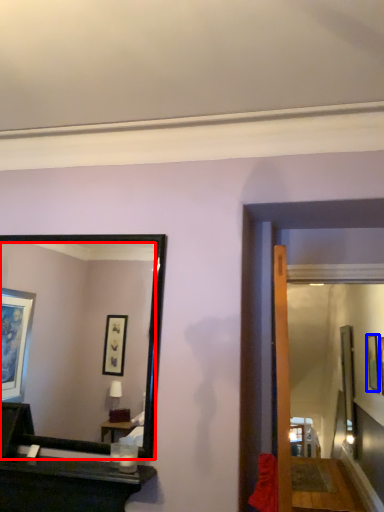
Question: Which of the following is the closest to the observer, mirror (highlighted by a red box) or picture frame (highlighted by a blue box)?

Choices:
 (A) mirror
 (B) picture frame

Answer: (A)